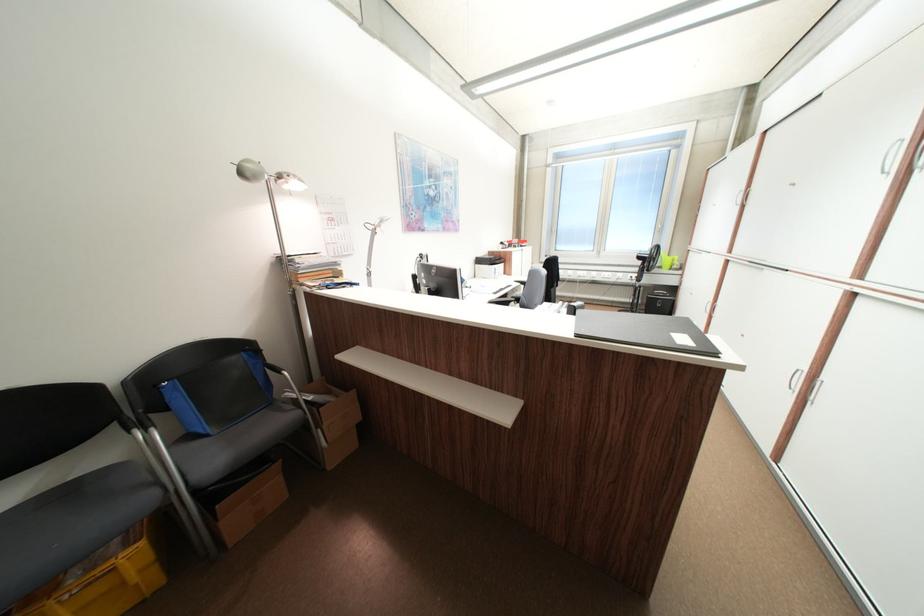
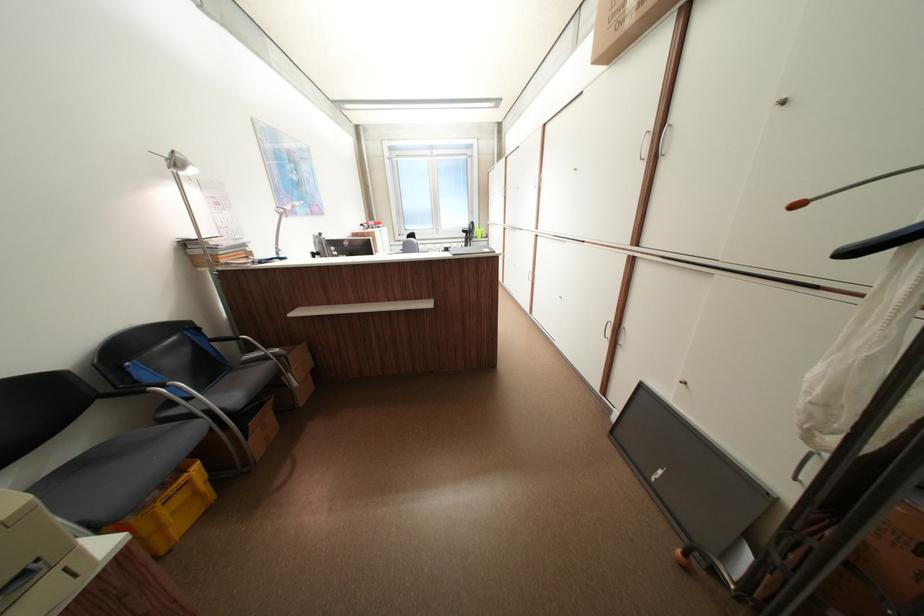
In the second image, find the point that corresponds to (132,584) in the first image.

(204, 493)